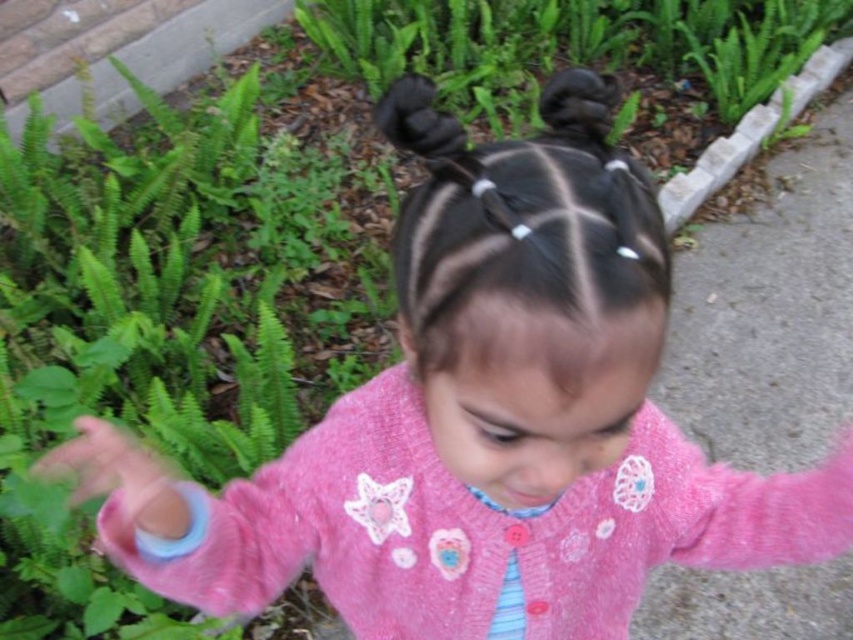
Is pink fabric hand at lower left positioned at the back of black hair at upper center?

Yes, it is.

Does pink fabric hand at lower left have a lesser width compared to black hair at upper center?

In fact, pink fabric hand at lower left might be wider than black hair at upper center.

Does point (160, 520) lie in front of point (613, 92)?

Yes, point (160, 520) is closer to viewer.

Find the location of `pink fabric hand at lower left`. pink fabric hand at lower left is located at coordinates (119, 476).